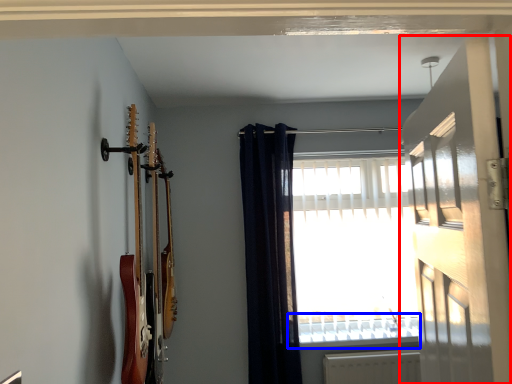
Question: Which of the following is the closest to the observer, door (highlighted by a red box) or window sill (highlighted by a blue box)?

Choices:
 (A) door
 (B) window sill

Answer: (A)